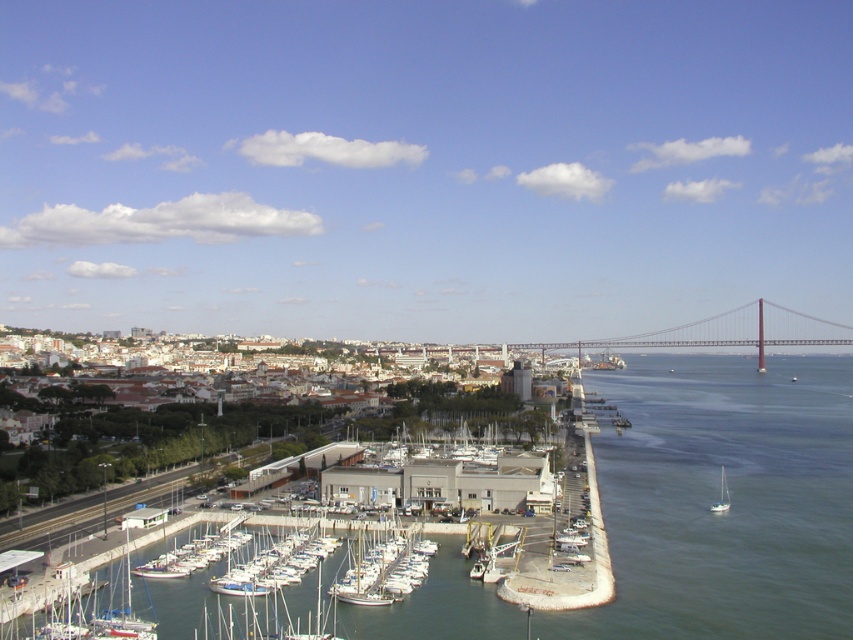
Question: Observing the image, what is the correct spatial positioning of white wooden sailboat at center in reference to white matte sailboat at lower left?

Choices:
 (A) right
 (B) left

Answer: (A)

Question: Among these objects, which one is farthest from the camera?

Choices:
 (A) white matte sailboat at center
 (B) white matte sailboat at lower right

Answer: (B)

Question: Among these points, which one is nearest to the camera?

Choices:
 (A) (717, 506)
 (B) (769, 451)
 (C) (500, 561)
 (D) (148, 628)

Answer: (D)

Question: Estimate the real-world distances between objects in this image. Which object is closer to the white matte sailboat at center?

Choices:
 (A) white wooden sailboat at center
 (B) white matte sailboat at lower left
 (C) greenish-blue water at lower right
 (D) white matte sailboat at lower right

Answer: (A)

Question: Observing the image, what is the correct spatial positioning of greenish-blue water at lower right in reference to white matte sailboat at center?

Choices:
 (A) above
 (B) below

Answer: (A)

Question: Can you confirm if white wooden sailboat at center is wider than white matte sailboat at center?

Choices:
 (A) yes
 (B) no

Answer: (A)